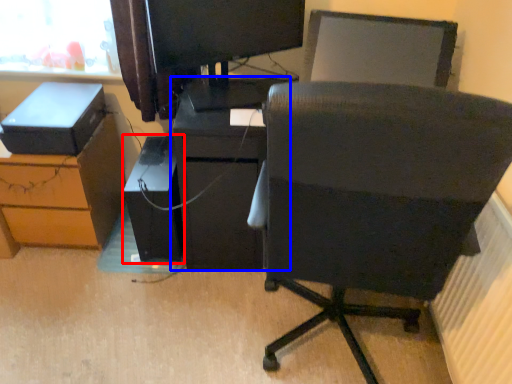
Question: Which of the following is the closest to the observer, computer tower (highlighted by a red box) or furniture (highlighted by a blue box)?

Choices:
 (A) computer tower
 (B) furniture

Answer: (B)